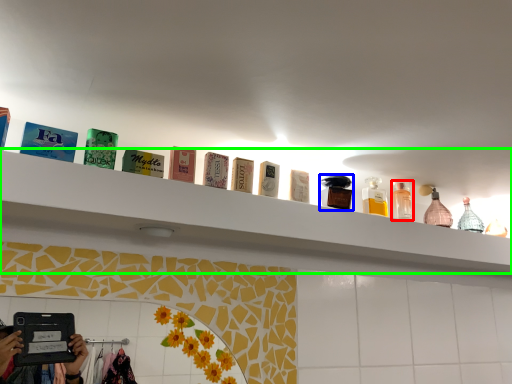
Question: Which object is positioned farthest from toiletry (highlighted by a red box)? Select from toiletry (highlighted by a blue box) and shelf (highlighted by a green box).

Choices:
 (A) toiletry
 (B) shelf

Answer: (B)